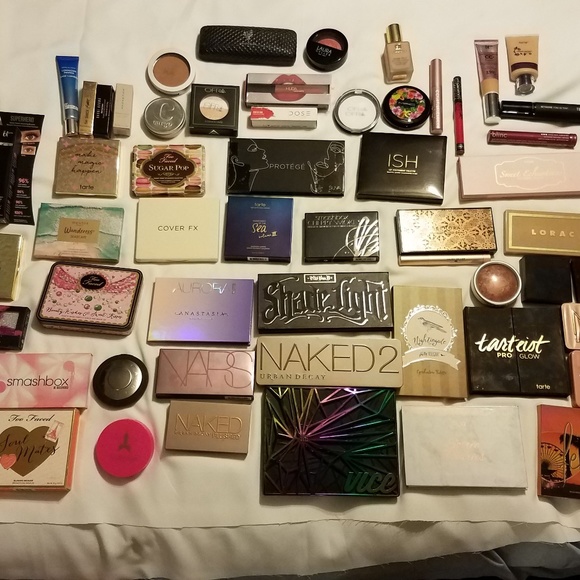
You are a GUI agent. You are given a task and a screenshot of the screen. Output one action in this format:
    pyautogui.click(x=<x>, y=<y>)
    Task: Click on the pink container
    
    Given the screenshot: What is the action you would take?
    pyautogui.click(x=139, y=445)